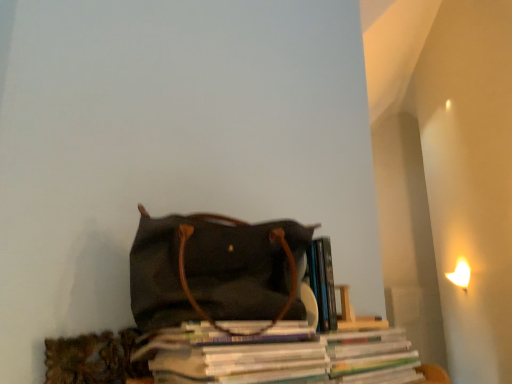
Question: From the image's perspective, is white glossy magazine at center on top of canvas handbag at center?

Choices:
 (A) yes
 (B) no

Answer: (B)

Question: Does white glossy magazine at center come in front of canvas handbag at center?

Choices:
 (A) no
 (B) yes

Answer: (B)

Question: Would you say white glossy magazine at center is outside canvas handbag at center?

Choices:
 (A) no
 (B) yes

Answer: (B)

Question: Can you confirm if white glossy magazine at center is shorter than canvas handbag at center?

Choices:
 (A) yes
 (B) no

Answer: (A)

Question: Is white glossy magazine at center facing away from canvas handbag at center?

Choices:
 (A) yes
 (B) no

Answer: (B)

Question: Can you confirm if white glossy magazine at center is positioned to the left of canvas handbag at center?

Choices:
 (A) no
 (B) yes

Answer: (A)

Question: Can you confirm if canvas handbag at center is shorter than white glossy magazine at center?

Choices:
 (A) no
 (B) yes

Answer: (A)

Question: Is canvas handbag at center thinner than white glossy magazine at center?

Choices:
 (A) no
 (B) yes

Answer: (A)

Question: Is canvas handbag at center at the right side of white glossy magazine at center?

Choices:
 (A) yes
 (B) no

Answer: (B)

Question: From the image's perspective, would you say canvas handbag at center is positioned over white glossy magazine at center?

Choices:
 (A) no
 (B) yes

Answer: (B)

Question: Is canvas handbag at center facing away from white glossy magazine at center?

Choices:
 (A) yes
 (B) no

Answer: (B)

Question: Is canvas handbag at center positioned before white glossy magazine at center?

Choices:
 (A) yes
 (B) no

Answer: (B)

Question: From a real-world perspective, is white glossy magazine at center physically located above or below canvas handbag at center?

Choices:
 (A) below
 (B) above

Answer: (A)